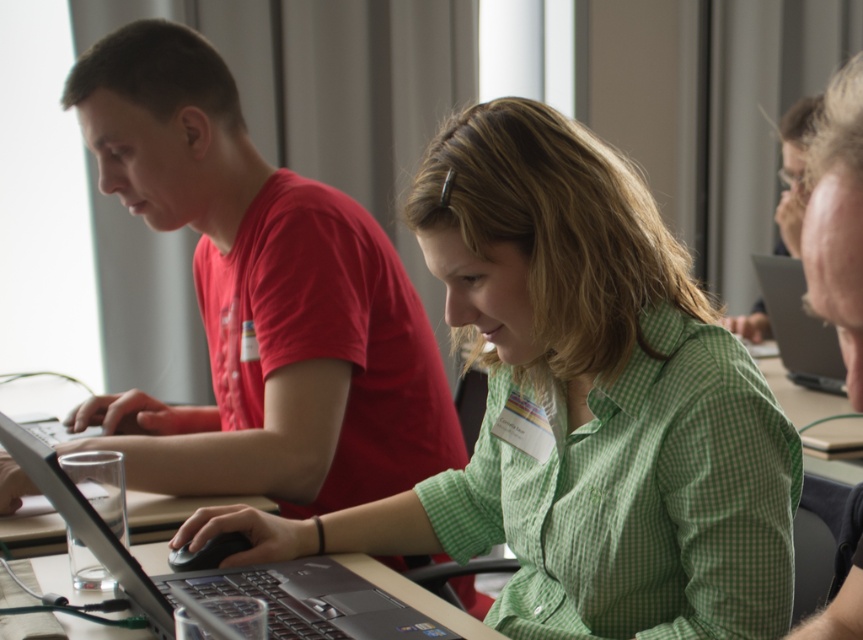
Question: Does silver metallic laptop at center appear under silver metallic laptop at right?

Choices:
 (A) no
 (B) yes

Answer: (B)

Question: Which of the following is the closest to the observer?

Choices:
 (A) silver metallic laptop at center
 (B) silver metallic laptop at right
 (C) matte black laptop at left

Answer: (A)

Question: Which point is farther to the camera?

Choices:
 (A) silver metallic laptop at center
 (B) silver metallic laptop at right
 (C) matte black laptop at left

Answer: (B)

Question: Does silver metallic laptop at center appear on the right side of silver metallic laptop at right?

Choices:
 (A) no
 (B) yes

Answer: (A)

Question: Observing the image, what is the correct spatial positioning of matte black laptop at left in reference to silver metallic laptop at center?

Choices:
 (A) left
 (B) right

Answer: (B)

Question: Which object is positioned farthest from the silver metallic laptop at right?

Choices:
 (A) matte black laptop at left
 (B) silver metallic laptop at center

Answer: (B)